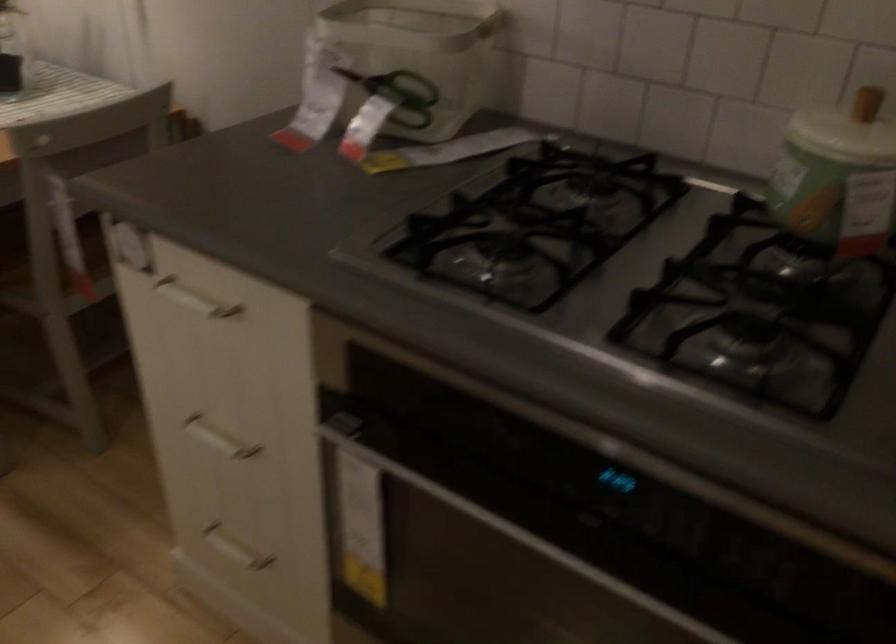
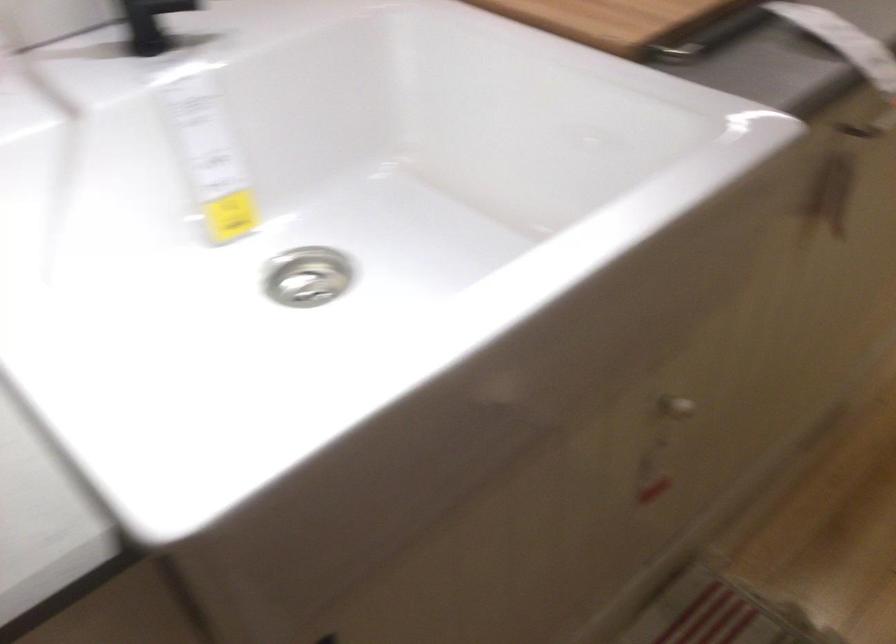
First-person continuous shooting, in which direction is the camera rotating?

The rotation direction of the camera is left-down.